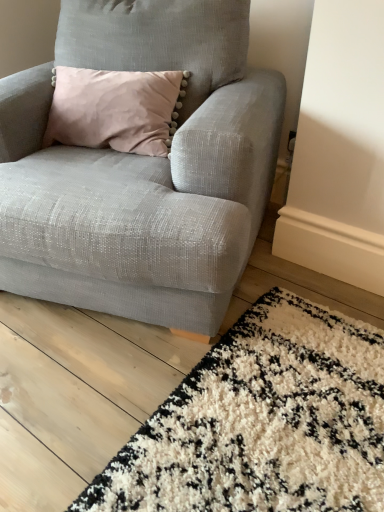
Question: Is white shaggy rug at lower right looking in the opposite direction of textured gray armchair at center?

Choices:
 (A) no
 (B) yes

Answer: (A)

Question: Would you consider white shaggy rug at lower right to be distant from textured gray armchair at center?

Choices:
 (A) no
 (B) yes

Answer: (A)

Question: Can you confirm if white shaggy rug at lower right is positioned to the right of textured gray armchair at center?

Choices:
 (A) no
 (B) yes

Answer: (B)

Question: From the image's perspective, would you say white shaggy rug at lower right is positioned over textured gray armchair at center?

Choices:
 (A) no
 (B) yes

Answer: (A)

Question: Is white shaggy rug at lower right to the left of textured gray armchair at center from the viewer's perspective?

Choices:
 (A) yes
 (B) no

Answer: (B)

Question: Is textured gray armchair at center surrounded by white shaggy rug at lower right?

Choices:
 (A) no
 (B) yes

Answer: (A)

Question: Is textured gray armchair at center positioned before white shaggy rug at lower right?

Choices:
 (A) no
 (B) yes

Answer: (A)

Question: Can you confirm if textured gray armchair at center is shorter than white shaggy rug at lower right?

Choices:
 (A) no
 (B) yes

Answer: (A)

Question: Is textured gray armchair at center at the left side of white shaggy rug at lower right?

Choices:
 (A) no
 (B) yes

Answer: (B)

Question: Can you see textured gray armchair at center touching white shaggy rug at lower right?

Choices:
 (A) yes
 (B) no

Answer: (B)

Question: From a real-world perspective, is textured gray armchair at center under white shaggy rug at lower right?

Choices:
 (A) yes
 (B) no

Answer: (B)

Question: Is textured gray armchair at center oriented towards white shaggy rug at lower right?

Choices:
 (A) yes
 (B) no

Answer: (B)

Question: Is white shaggy rug at lower right taller or shorter than textured gray armchair at center?

Choices:
 (A) short
 (B) tall

Answer: (A)